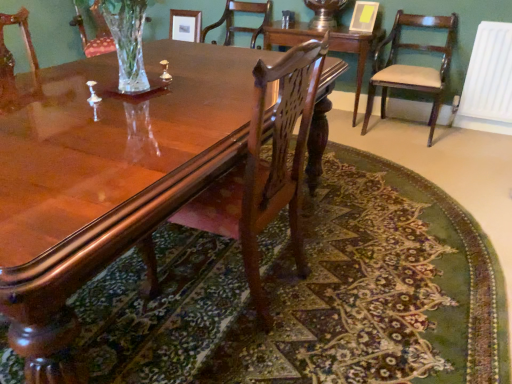
This screenshot has width=512, height=384. In order to click on vacant region under white plastic radiator at right (from a real-world perspective) in this screenshot , I will do `click(474, 133)`.